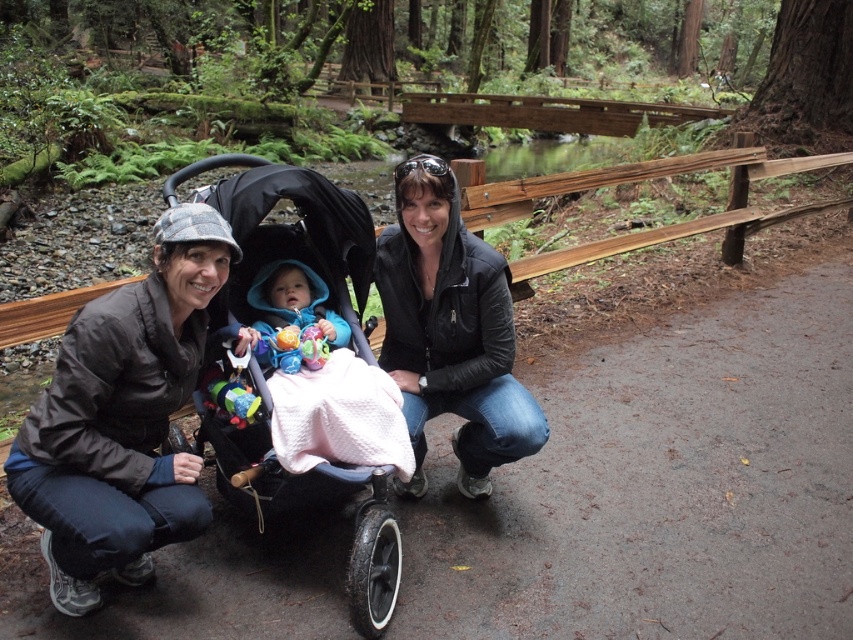
Question: Which object appears farthest from the camera in this image?

Choices:
 (A) black matte stroller at center
 (B) blue fabric baby at center
 (C) black leather jacket at center
 (D) brown matte jacket at lower left

Answer: (C)

Question: Is brown matte jacket at lower left to the right of blue fleece jacket at center from the viewer's perspective?

Choices:
 (A) no
 (B) yes

Answer: (A)

Question: Which point appears closest to the camera in this image?

Choices:
 (A) (326, 180)
 (B) (387, 317)
 (C) (196, 300)
 (D) (279, 262)

Answer: (C)

Question: Is brown matte jacket at lower left below black matte stroller at center?

Choices:
 (A) yes
 (B) no

Answer: (A)

Question: Does brown matte jacket at lower left have a smaller size compared to blue fleece jacket at center?

Choices:
 (A) no
 (B) yes

Answer: (A)

Question: Among these objects, which one is nearest to the camera?

Choices:
 (A) brown matte jacket at lower left
 (B) black leather jacket at center
 (C) black matte stroller at center
 (D) blue fleece jacket at center

Answer: (A)